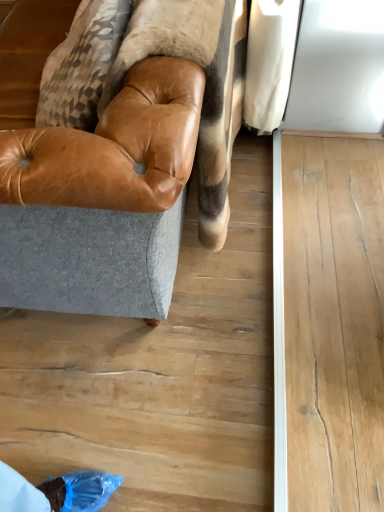
The image size is (384, 512). I want to click on free location above wooden plank at lower right (from a real-world perspective), so click(334, 330).